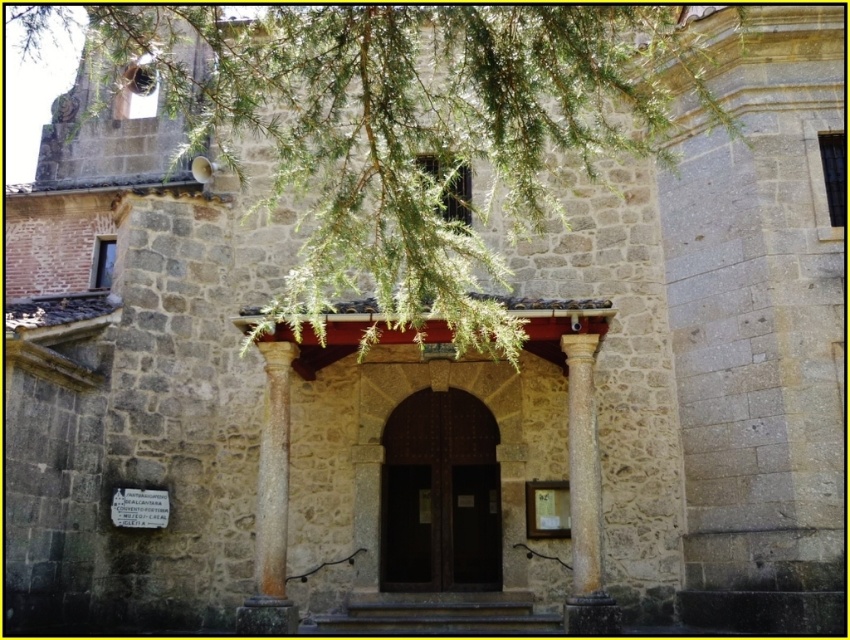
Question: Which object is the farthest from the sandy brown stone column at center?

Choices:
 (A) smooth stone column at center
 (B) dark wood door at center

Answer: (A)

Question: Which of the following is the farthest from the observer?

Choices:
 (A) dark wood door at center
 (B) smooth stone column at center

Answer: (A)

Question: Can you confirm if sandy brown stone column at center is thinner than smooth stone column at center?

Choices:
 (A) yes
 (B) no

Answer: (A)

Question: Which of the following is the closest to the observer?

Choices:
 (A) green leafy branch at upper center
 (B) smooth stone column at center
 (C) sandy brown stone column at center
 (D) dark wood door at center

Answer: (A)

Question: Can you confirm if green leafy branch at upper center is positioned below smooth stone column at center?

Choices:
 (A) yes
 (B) no

Answer: (B)

Question: Is dark wood door at center wider than sandy brown stone column at center?

Choices:
 (A) yes
 (B) no

Answer: (A)